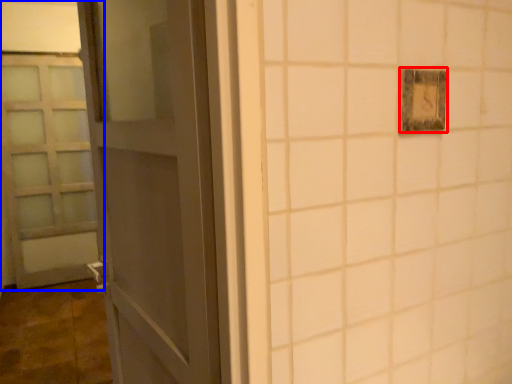
Question: Which object is closer to the camera taking this photo, light switch (highlighted by a red box) or door (highlighted by a blue box)?

Choices:
 (A) light switch
 (B) door

Answer: (A)